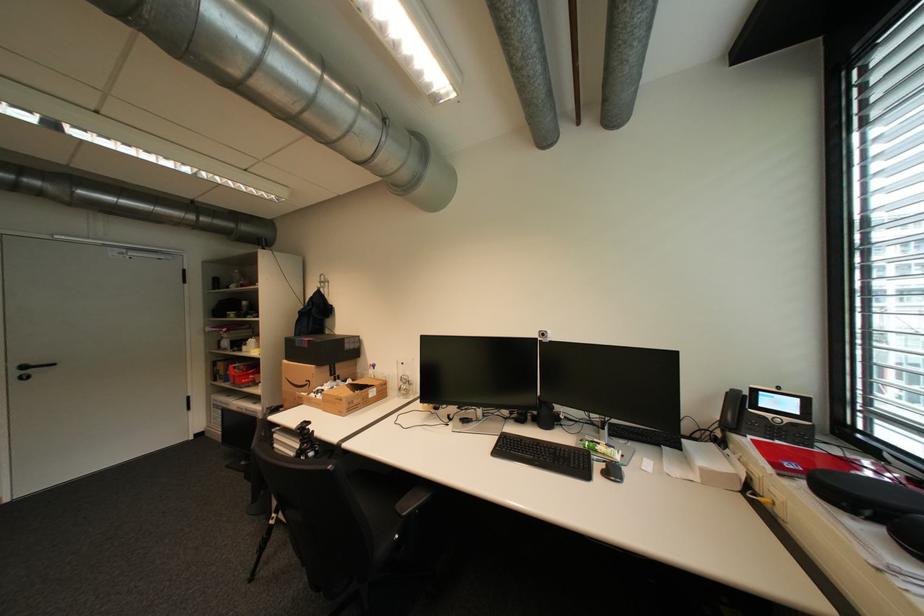
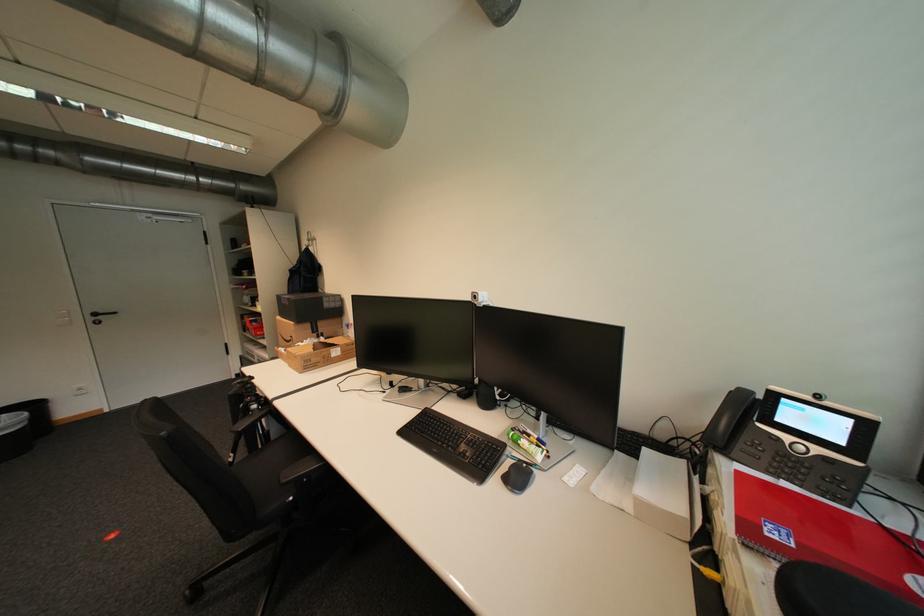
In the second image, find the point that corresponds to pixel 552 334 in the first image.

(483, 297)